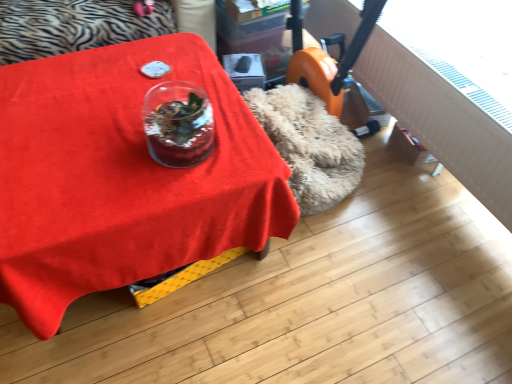
This screenshot has width=512, height=384. Identify the location of matte red tablecloth at center. (122, 177).

What do you see at coordinates (122, 177) in the screenshot? I see `matte red tablecloth at center` at bounding box center [122, 177].

Image resolution: width=512 pixels, height=384 pixels. Describe the element at coordinates (178, 124) in the screenshot. I see `transparent glass vase at center` at that location.

This screenshot has height=384, width=512. Identify the location of transparent glass vase at center. (178, 124).

Identify the location of matte red tablecloth at center. The image size is (512, 384). (122, 177).

Is transparent glass vase at center to the left of matte red tablecloth at center from the viewer's perspective?

No.

Considering the relative positions of transparent glass vase at center and matte red tablecloth at center in the image provided, is transparent glass vase at center behind matte red tablecloth at center?

Yes, it is.

Which point is more forward, (163, 152) or (136, 157)?

The point (163, 152) is in front.

From the image's perspective, which object appears higher, transparent glass vase at center or matte red tablecloth at center?

transparent glass vase at center is shown above in the image.

From a real-world perspective, is transparent glass vase at center beneath matte red tablecloth at center?

Actually, transparent glass vase at center is physically above matte red tablecloth at center in the real world.

Is transparent glass vase at center wider or thinner than matte red tablecloth at center?

transparent glass vase at center is thinner than matte red tablecloth at center.

Which of these two, transparent glass vase at center or matte red tablecloth at center, stands taller?

matte red tablecloth at center is taller.

In terms of size, does transparent glass vase at center appear bigger or smaller than matte red tablecloth at center?

transparent glass vase at center is smaller than matte red tablecloth at center.

Is transparent glass vase at center not inside matte red tablecloth at center?

Yes, transparent glass vase at center is not within matte red tablecloth at center.

Is transparent glass vase at center next to matte red tablecloth at center?

No, transparent glass vase at center is not beside matte red tablecloth at center.

Is transparent glass vase at center aimed at matte red tablecloth at center?

No, transparent glass vase at center is not turned towards matte red tablecloth at center.

How much distance is there between transparent glass vase at center and matte red tablecloth at center?

transparent glass vase at center is 7.58 inches away from matte red tablecloth at center.

Identify the location of glass vase above the matte red tablecloth at center (from the image's perspective). This screenshot has height=384, width=512. (178, 124).

Would you say matte red tablecloth at center is to the left or to the right of transparent glass vase at center in the picture?

matte red tablecloth at center is positioned on transparent glass vase at center's left side.

Is matte red tablecloth at center in front of or behind transparent glass vase at center in the image?

In the image, matte red tablecloth at center appears in front of transparent glass vase at center.

Is point (80, 73) closer or farther from the camera than point (157, 130)?

Point (80, 73) appears to be farther away from the viewer than point (157, 130).

From the image's perspective, is matte red tablecloth at center over transparent glass vase at center?

Incorrect, from the image's perspective, matte red tablecloth at center is lower than transparent glass vase at center.

From a real-world perspective, is matte red tablecloth at center located beneath transparent glass vase at center?

Yes, from a real-world perspective, matte red tablecloth at center is beneath transparent glass vase at center.

Considering the sizes of objects matte red tablecloth at center and transparent glass vase at center in the image provided, who is wider, matte red tablecloth at center or transparent glass vase at center?

With larger width is matte red tablecloth at center.

Considering the relative sizes of matte red tablecloth at center and transparent glass vase at center in the image provided, is matte red tablecloth at center shorter than transparent glass vase at center?

Incorrect, the height of matte red tablecloth at center does not fall short of that of transparent glass vase at center.

Can you confirm if matte red tablecloth at center is bigger than transparent glass vase at center?

Yes.

Is matte red tablecloth at center not inside transparent glass vase at center?

That's correct, matte red tablecloth at center is outside of transparent glass vase at center.

Does matte red tablecloth at center touch transparent glass vase at center?

No, matte red tablecloth at center is not next to transparent glass vase at center.

Could you tell me if matte red tablecloth at center is facing transparent glass vase at center?

No, matte red tablecloth at center is not facing towards transparent glass vase at center.

Measure the distance from matte red tablecloth at center to transparent glass vase at center.

They are 19.26 centimeters apart.

You are a GUI agent. You are given a task and a screenshot of the screen. Output one action in this format:
    pyautogui.click(x=<x>, y=<y>)
    Task: Click on the table below the transparent glass vase at center (from a real-world perspective)
    
    Given the screenshot: What is the action you would take?
    [x=122, y=177]

The image size is (512, 384). Identify the location of table that appears on the left of transparent glass vase at center. (122, 177).

Locate an element on the screen. glass vase that is above the matte red tablecloth at center (from the image's perspective) is located at coordinates (178, 124).